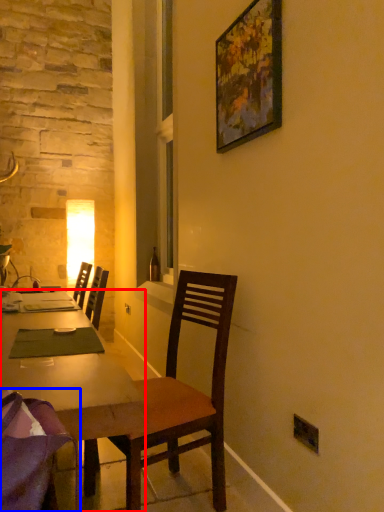
Question: Which object appears farthest to the camera in this image, desk (highlighted by a red box) or chair (highlighted by a blue box)?

Choices:
 (A) desk
 (B) chair

Answer: (A)